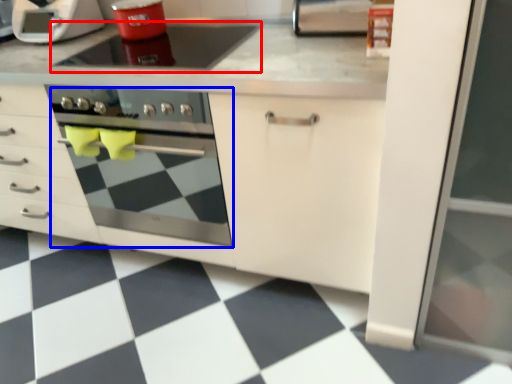
Question: Which object is further to the camera taking this photo, gas stove (highlighted by a red box) or oven (highlighted by a blue box)?

Choices:
 (A) gas stove
 (B) oven

Answer: (A)